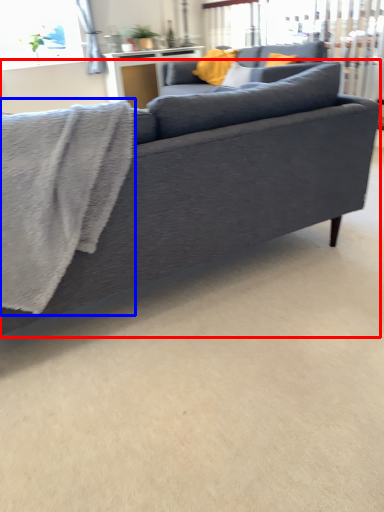
Question: Which object is closer to the camera taking this photo, studio couch (highlighted by a red box) or bath towel (highlighted by a blue box)?

Choices:
 (A) studio couch
 (B) bath towel

Answer: (A)